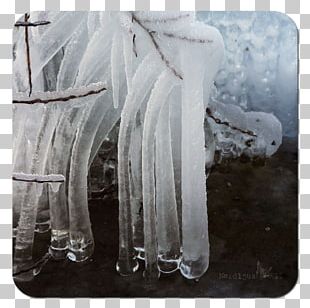
Where is `picture`? picture is located at coordinates (287, 218).